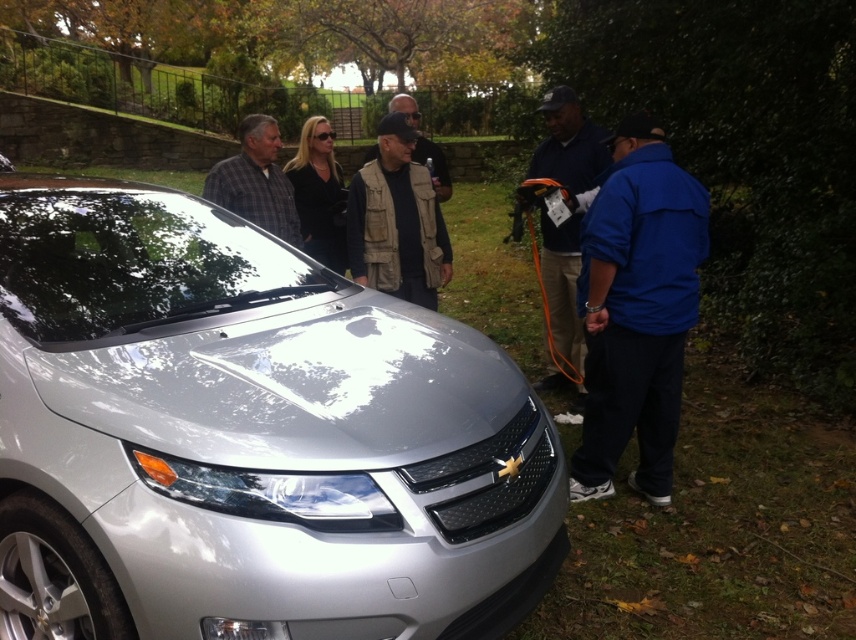
You are a photographer standing 2 meters away from the sleek silver car at center. Can you take a clear photo of it without moving closer? Explain your reasoning.

The sleek silver car at center and camera are 1.91 meters apart from each other. Since the photographer is standing 2 meters away, which is slightly farther than the 1.91 meters distance required, the camera can still capture a clear photo as the distance is close enough. However, moving a bit closer might improve clarity.